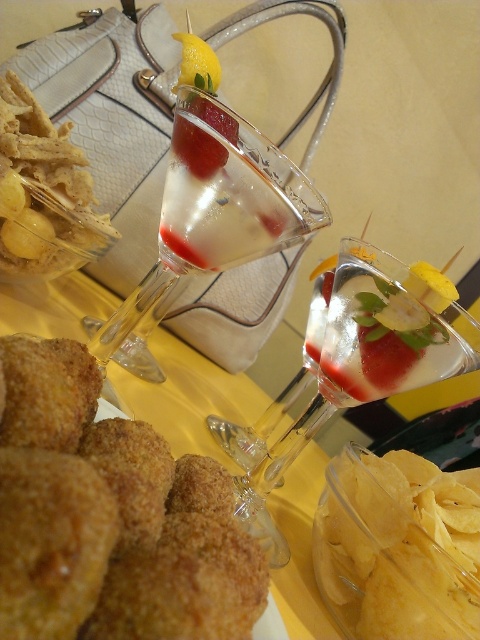
Does golden crispy chips at lower right have a lesser height compared to matte red wine at center?

Incorrect, golden crispy chips at lower right's height does not fall short of matte red wine at center's.

Locate an element on the screen. golden crispy chips at lower right is located at coordinates (384, 563).

Between golden crispy croquettes at lower left and yellow citrus at center, which one appears on the right side from the viewer's perspective?

Positioned to the right is golden crispy croquettes at lower left.

Which is in front, point (116, 570) or point (188, 42)?

Point (116, 570) is in front.

Is point (217, 593) positioned behind point (182, 83)?

No, it is not.

Locate an element on the screen. golden crispy croquettes at lower left is located at coordinates (107, 520).

Does translucent glass cocktail at center have a lesser height compared to yellow citrus at center?

Correct, translucent glass cocktail at center is not as tall as yellow citrus at center.

Who is higher up, translucent glass cocktail at center or yellow citrus at center?

yellow citrus at center is above.

Which is in front, point (399, 314) or point (193, 44)?

Positioned in front is point (399, 314).

Find the location of a particular element. The width and height of the screenshot is (480, 640). translucent glass cocktail at center is located at coordinates (362, 364).